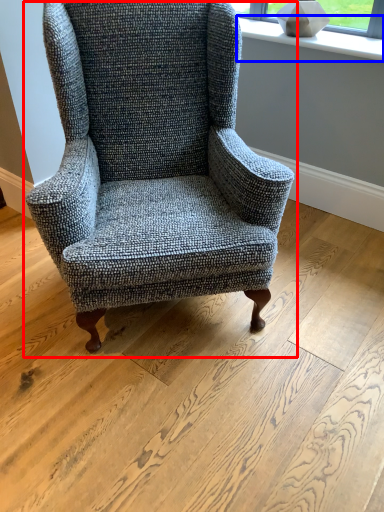
Question: Which of the following is the farthest to the observer, chair (highlighted by a red box) or window sill (highlighted by a blue box)?

Choices:
 (A) chair
 (B) window sill

Answer: (B)